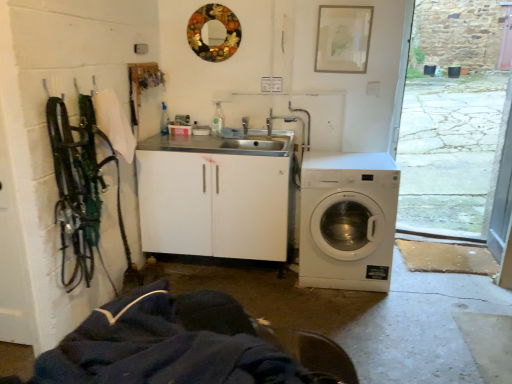
Question: Considering the relative sizes of metallic circular mirror at upper center and white plastic washing machine at lower right in the image provided, is metallic circular mirror at upper center shorter than white plastic washing machine at lower right?

Choices:
 (A) no
 (B) yes

Answer: (B)

Question: From a real-world perspective, is metallic circular mirror at upper center positioned over white plastic washing machine at lower right based on gravity?

Choices:
 (A) yes
 (B) no

Answer: (A)

Question: Can you confirm if metallic circular mirror at upper center is taller than white plastic washing machine at lower right?

Choices:
 (A) yes
 (B) no

Answer: (B)

Question: Is metallic circular mirror at upper center outside of white plastic washing machine at lower right?

Choices:
 (A) no
 (B) yes

Answer: (B)

Question: Is metallic circular mirror at upper center not close to white plastic washing machine at lower right?

Choices:
 (A) no
 (B) yes

Answer: (B)

Question: Is metallic circular mirror at upper center positioned behind white plastic washing machine at lower right?

Choices:
 (A) no
 (B) yes

Answer: (B)

Question: From a real-world perspective, does white plastic washing machine at lower right stand above metallic circular mirror at upper center?

Choices:
 (A) no
 (B) yes

Answer: (A)

Question: Is white plastic washing machine at lower right positioned with its back to metallic circular mirror at upper center?

Choices:
 (A) yes
 (B) no

Answer: (B)

Question: Is white plastic washing machine at lower right located outside metallic circular mirror at upper center?

Choices:
 (A) no
 (B) yes

Answer: (B)

Question: Would you say metallic circular mirror at upper center is part of white plastic washing machine at lower right's contents?

Choices:
 (A) yes
 (B) no

Answer: (B)

Question: Is white plastic washing machine at lower right to the right of metallic circular mirror at upper center from the viewer's perspective?

Choices:
 (A) no
 (B) yes

Answer: (B)

Question: Can you confirm if white plastic washing machine at lower right is thinner than metallic circular mirror at upper center?

Choices:
 (A) no
 (B) yes

Answer: (A)

Question: In terms of width, does white plastic washing machine at lower right look wider or thinner when compared to metallic circular mirror at upper center?

Choices:
 (A) thin
 (B) wide

Answer: (B)